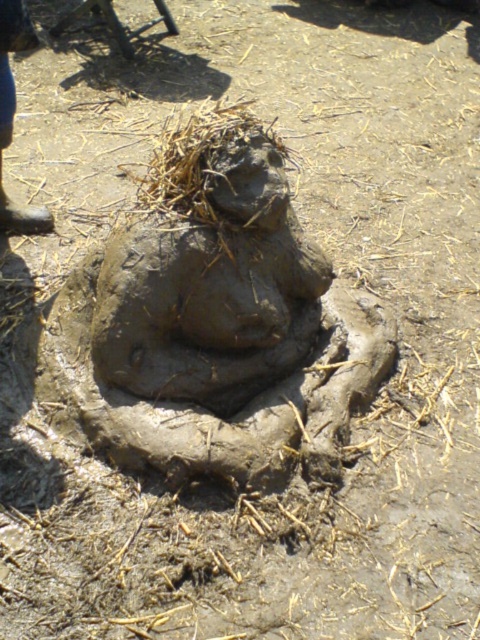
You are an artist working on a sculpture. You see the clay figure at center and the blue jeans at left in the scene. Which object is closer to the ground?

The clay figure at center is positioned under blue jeans at left, so the clay figure at center is closer to the ground.

You are an artist standing at the origin point of the coordinate system. You want to place a new clay sculpture exactly 0.1 meters to the north of the clay figure at center. What are the coordinates of the new sculpture?

The clay figure at center is located at point (216, 323). Moving 0.1 meters north would add 0.1 to the y coordinate, resulting in new coordinates of (264, 323).